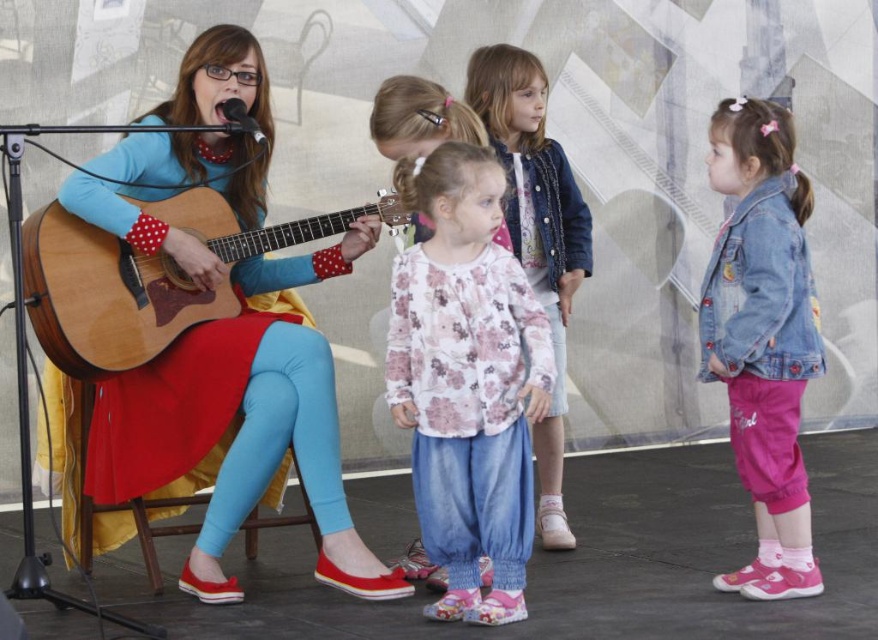
You are a stagehand setting up a new microphone stand. The wooden acoustic guitar at left and the floral fabric shirt at center are in the current setup. If the microphone stand requires 3 square feet of space, can it be placed between these two objects without moving them?

The wooden acoustic guitar at left occupies less space than the floral fabric shirt at center. Therefore, there might be enough space between them to place the microphone stand, but since the exact distance isn

You are a photographer trying to capture a group photo of the denim jacket at lower right and the floral fabric shirt at center. Which object should you place on the right side of your camera frame to ensure both are in the shot?

To ensure both the denim jacket at lower right and the floral fabric shirt at center are in the shot, you should place the denim jacket at lower right on the right side of your camera frame since it is already positioned to the right of the floral fabric shirt at center.

You are a photographer trying to capture a group photo of the two children wearing floral shirts in the scene. The camera you have can only focus on objects within a 25 inch range. Will you be able to take a clear photo of both the floral cotton shirt at center and the floral fabric shirt at center without moving the camera or the subjects?

The floral cotton shirt at center and floral fabric shirt at center are 27.94 inches apart from each other. Since the camera can only focus within a 25 inch range, the distance between them exceeds the focus range. Therefore, you cannot take a clear photo of both shirts simultaneously without adjusting the camera or moving the subjects.